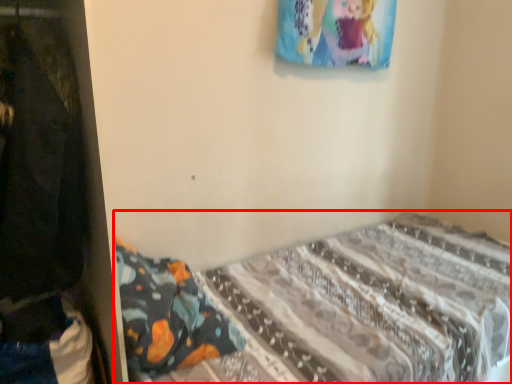
Question: In this image, where is bed (annotated by the red box) located relative to closet?

Choices:
 (A) right
 (B) left

Answer: (A)